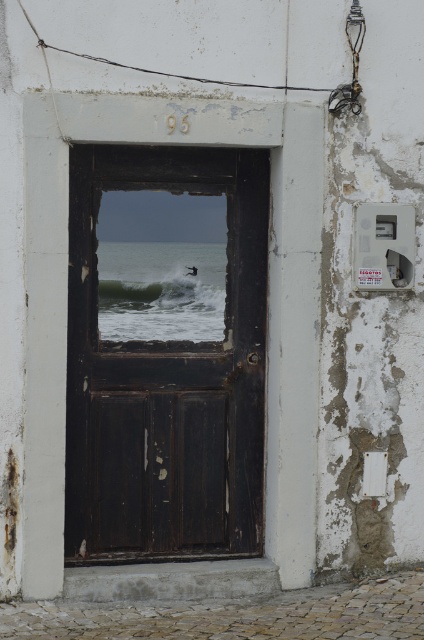
Question: Does dark wood door at center have a greater width compared to green frothy wave at center?

Choices:
 (A) yes
 (B) no

Answer: (A)

Question: Among these objects, which one is nearest to the camera?

Choices:
 (A) green frothy wave at center
 (B) dark wood door at center

Answer: (B)

Question: Among these points, which one is nearest to the camera?

Choices:
 (A) (113, 305)
 (B) (75, 545)

Answer: (B)

Question: Observing the image, what is the correct spatial positioning of dark wood door at center in reference to green frothy wave at center?

Choices:
 (A) left
 (B) right

Answer: (B)

Question: Does dark wood door at center appear under green frothy wave at center?

Choices:
 (A) yes
 (B) no

Answer: (A)